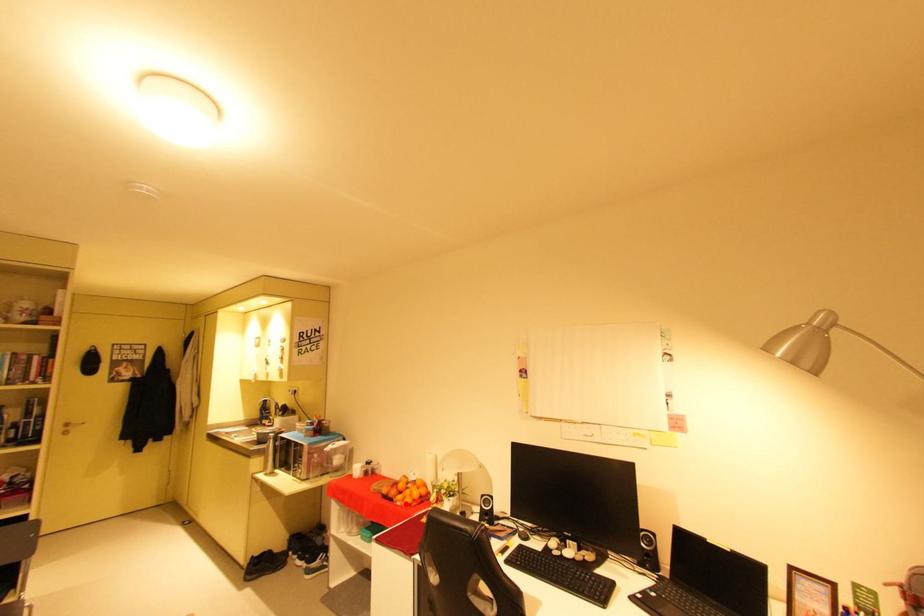
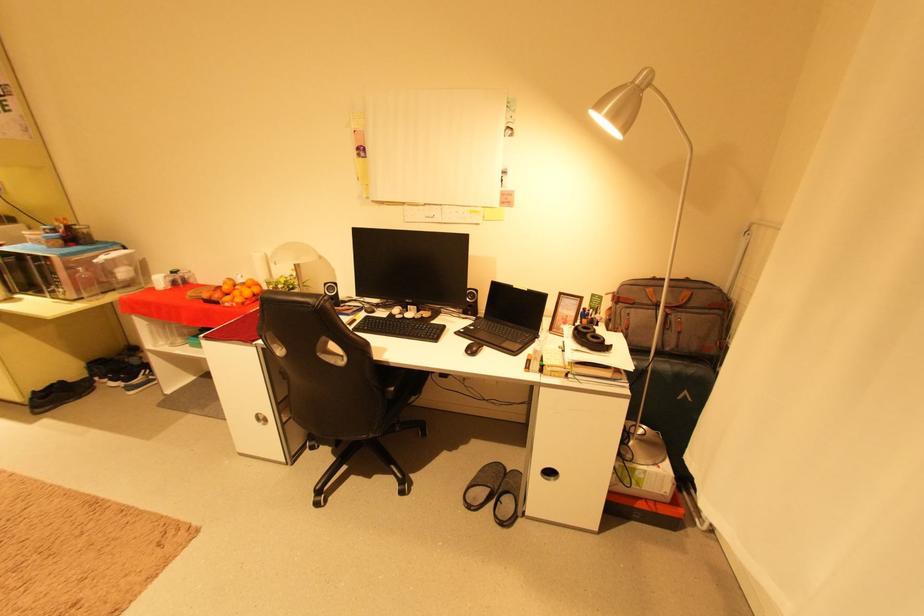
Question: A red point is marked in image1. In image2, is the corresponding 3D point closer to the camera or farther? Reply with the corresponding letter.

Choices:
 (A) The corresponding 3D point is closer.
 (B) The corresponding 3D point is farther.

Answer: (B)